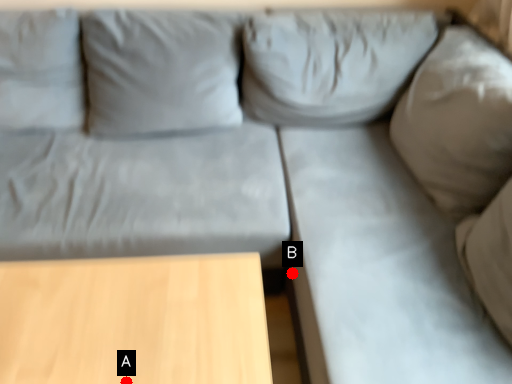
Question: Two points are circled on the image, labeled by A and B beside each circle. Which of the following is the closest to the observer?

Choices:
 (A) A is closer
 (B) B is closer

Answer: (A)